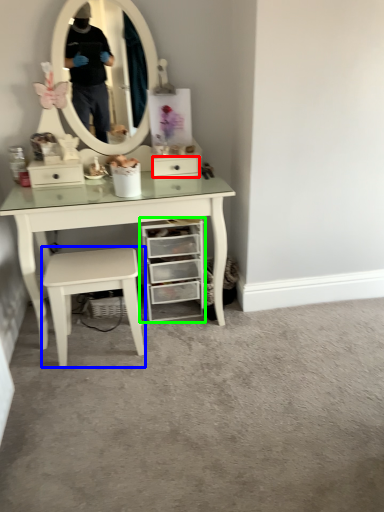
Question: Based on their relative distances, which object is nearer to drawer (highlighted by a red box)? Choose from stool (highlighted by a blue box) and chest of drawers (highlighted by a green box).

Choices:
 (A) stool
 (B) chest of drawers

Answer: (B)